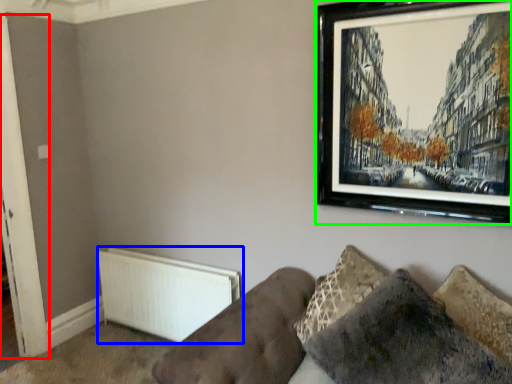
Question: Considering the real-world distances, which object is closest to door (highlighted by a red box)? radiator (highlighted by a blue box) or picture frame (highlighted by a green box).

Choices:
 (A) radiator
 (B) picture frame

Answer: (A)